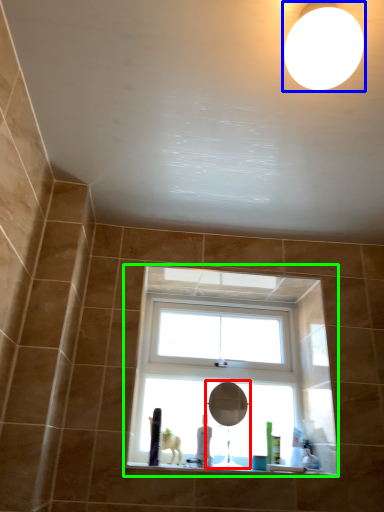
Question: Which object is the closest to the mirror (highlighted by a red box)? Choose among these: lighting (highlighted by a blue box) or window (highlighted by a green box).

Choices:
 (A) lighting
 (B) window

Answer: (B)